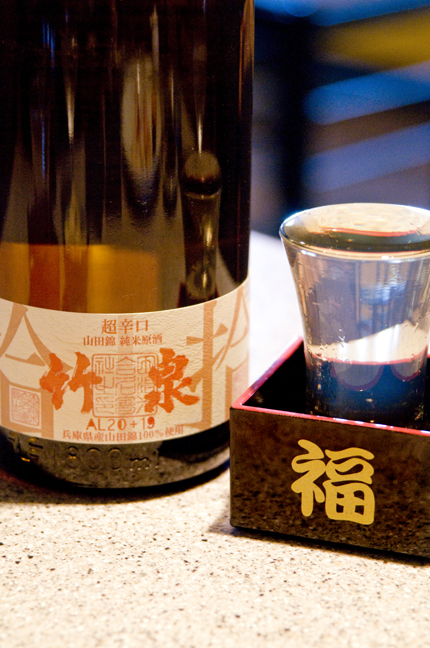
Locate an element on the screen. The width and height of the screenshot is (430, 648). shot glass is located at coordinates (370, 292).